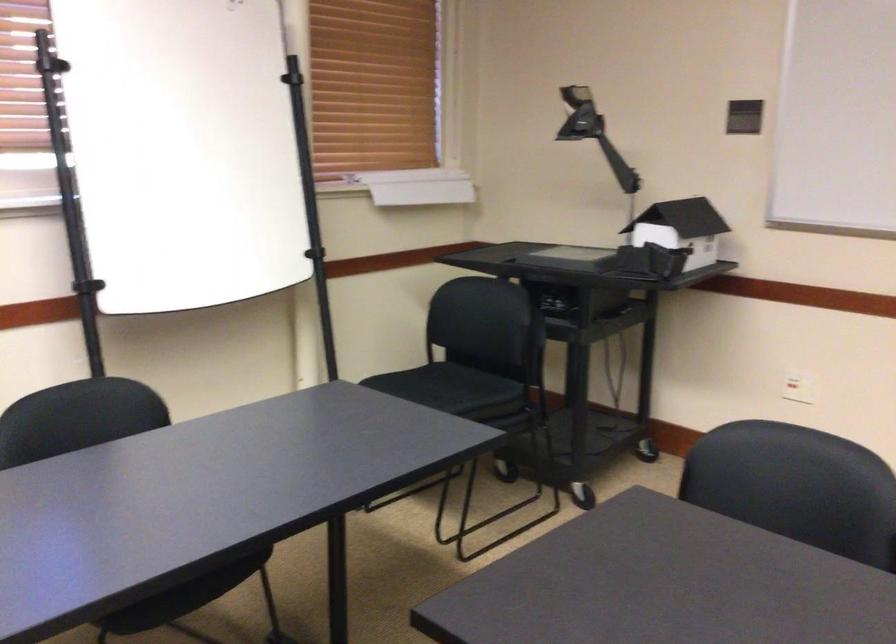
Where is `black chair sitting surface`? The width and height of the screenshot is (896, 644). black chair sitting surface is located at coordinates (449, 383).